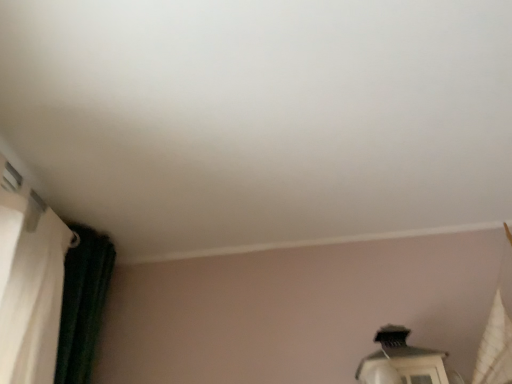
Measure the distance between white plastic table lamp at lower center and camera.

A distance of 1.08 meters exists between white plastic table lamp at lower center and camera.

The image size is (512, 384). What do you see at coordinates (404, 362) in the screenshot?
I see `white plastic table lamp at lower center` at bounding box center [404, 362].

Where is `white plastic table lamp at lower center`? This screenshot has width=512, height=384. white plastic table lamp at lower center is located at coordinates (404, 362).

You are a GUI agent. You are given a task and a screenshot of the screen. Output one action in this format:
    pyautogui.click(x=<x>, y=<y>)
    Task: Click on the white plastic table lamp at lower center
    This screenshot has height=384, width=512.
    Given the screenshot: What is the action you would take?
    pyautogui.click(x=404, y=362)